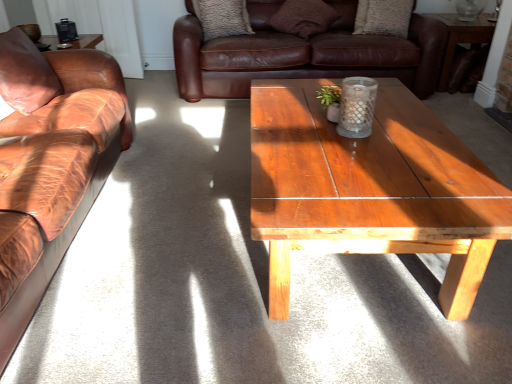
Question: Would you say brown suede pillow at upper center, the third pillow from the back, is part of textured brown pillow at upper center, the third pillow positioned from the right,'s contents?

Choices:
 (A) yes
 (B) no

Answer: (B)

Question: Could you tell me if textured brown pillow at upper center, which ranks as the 2th pillow in left-to-right order, is facing brown suede pillow at upper center, the third pillow from the back?

Choices:
 (A) no
 (B) yes

Answer: (A)

Question: Is textured brown pillow at upper center, the third pillow positioned from the right, far from brown suede pillow at upper center, the third pillow from the back?

Choices:
 (A) yes
 (B) no

Answer: (B)

Question: Is textured brown pillow at upper center, which ranks as the 2th pillow in left-to-right order, outside brown suede pillow at upper center, marked as the second pillow in a right-to-left arrangement?

Choices:
 (A) no
 (B) yes

Answer: (B)

Question: Is textured brown pillow at upper center, the third pillow positioned from the right, behind brown suede pillow at upper center, the third pillow from the back?

Choices:
 (A) no
 (B) yes

Answer: (B)

Question: Does textured brown pillow at upper center, which ranks as the 2th pillow in left-to-right order, come in front of brown suede pillow at upper center, marked as the second pillow in a right-to-left arrangement?

Choices:
 (A) yes
 (B) no

Answer: (B)

Question: Can you confirm if textured beige pillow at upper center, acting as the fourth pillow starting from the left, is positioned to the right of brown suede pillow at upper center, which ranks as the second pillow in front-to-back order?

Choices:
 (A) no
 (B) yes

Answer: (B)

Question: Is textured beige pillow at upper center, acting as the fourth pillow starting from the left, completely or partially outside of brown suede pillow at upper center, which is the 3th pillow in left-to-right order?

Choices:
 (A) no
 (B) yes

Answer: (B)

Question: Is textured beige pillow at upper center, which is the 4th pillow in front-to-back order, thinner than brown suede pillow at upper center, which is the 3th pillow in left-to-right order?

Choices:
 (A) yes
 (B) no

Answer: (A)

Question: Is the position of textured beige pillow at upper center, which appears as the 1th pillow when viewed from the back, more distant than that of brown suede pillow at upper center, which is the 3th pillow in left-to-right order?

Choices:
 (A) yes
 (B) no

Answer: (A)

Question: Could you tell me if textured beige pillow at upper center, acting as the fourth pillow starting from the left, is turned towards brown suede pillow at upper center, which ranks as the second pillow in front-to-back order?

Choices:
 (A) no
 (B) yes

Answer: (A)

Question: Is textured beige pillow at upper center, which is the 4th pillow in front-to-back order, next to brown suede pillow at upper center, which ranks as the second pillow in front-to-back order?

Choices:
 (A) yes
 (B) no

Answer: (B)

Question: Is textured brown pillow at upper center, the second pillow when ordered from back to front, not near brown leather couch at left, acting as the first studio couch starting from the front?

Choices:
 (A) yes
 (B) no

Answer: (A)